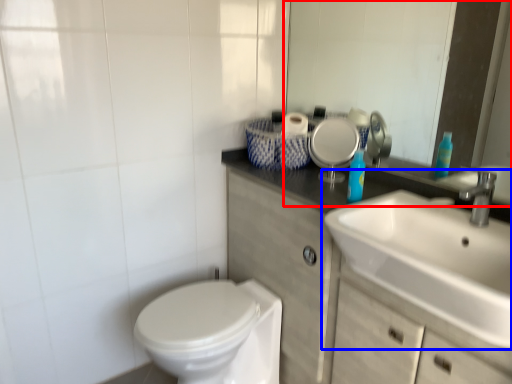
Question: Among these objects, which one is farthest to the camera, mirror (highlighted by a red box) or sink (highlighted by a blue box)?

Choices:
 (A) mirror
 (B) sink

Answer: (A)